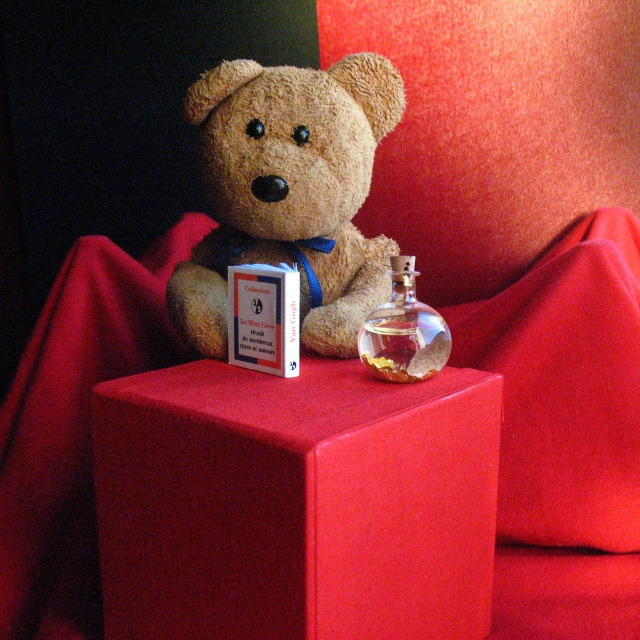
Does matte red cube at center have a greater width compared to soft plush teddy bear at center?

Yes.

Locate an element on the screen. This screenshot has width=640, height=640. matte red cube at center is located at coordinates (296, 502).

The image size is (640, 640). Describe the element at coordinates (296, 502) in the screenshot. I see `matte red cube at center` at that location.

At what (x,y) coordinates should I click in order to perform the action: click on matte red cube at center. Please return your answer as a coordinate pair (x, y). This screenshot has width=640, height=640. Looking at the image, I should click on (296, 502).

How distant is matte red cube at center from transparent glass bottle at center?

They are 7.78 inches apart.

Is point (173, 582) positioned after point (412, 365)?

No, (173, 582) is in front of (412, 365).

Where is `matte red cube at center`? This screenshot has width=640, height=640. matte red cube at center is located at coordinates (296, 502).

Is point (356, 321) behind point (406, 369)?

Yes, point (356, 321) is farther from viewer.

Does point (339, 209) lie in front of point (396, 291)?

No.

Is point (339, 93) farther from camera compared to point (413, 256)?

No, (339, 93) is closer to viewer.

Image resolution: width=640 pixels, height=640 pixels. Find the location of `soft plush teddy bear at center`. soft plush teddy bear at center is located at coordinates 289,193.